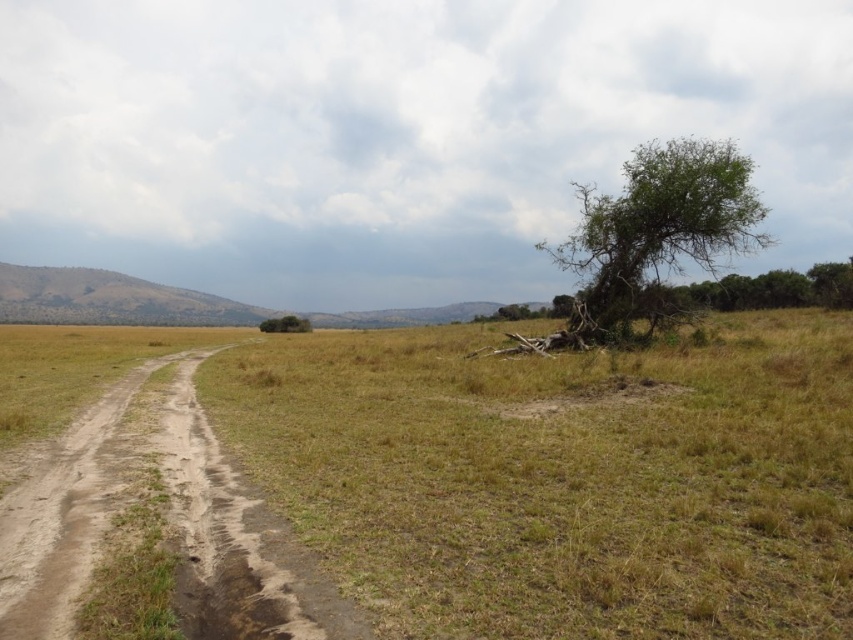
Which of these two, dry grass at center or green leafy tree at upper right, stands taller?

With more height is green leafy tree at upper right.

Who is higher up, dry grass at center or green leafy tree at upper right?

Positioned higher is green leafy tree at upper right.

Describe the element at coordinates (561, 480) in the screenshot. I see `dry grass at center` at that location.

Where is `dry grass at center`? dry grass at center is located at coordinates (561, 480).

Does brown dirt path at left appear under green leafy tree at center?

Correct, brown dirt path at left is located below green leafy tree at center.

Identify the location of brown dirt path at left. (163, 520).

Can you confirm if brown dirt path at left is taller than green leafy tree at upper right?

Incorrect, brown dirt path at left's height is not larger of green leafy tree at upper right's.

Does point (279, 573) lie behind point (621, 301)?

No, it is not.

Where is `brown dirt path at left`? brown dirt path at left is located at coordinates (163, 520).